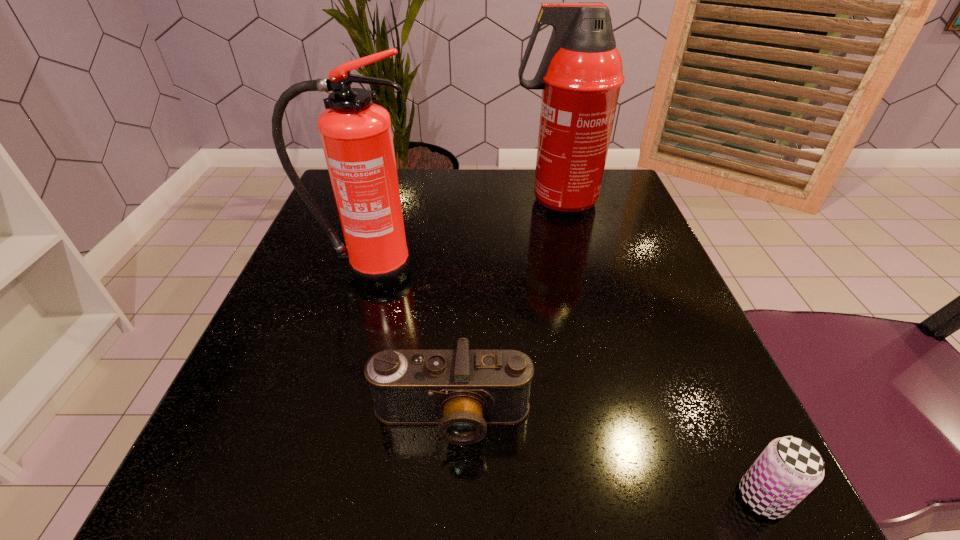
Where is `vacant point located between the beer can and the left fire extinguisher`? This screenshot has width=960, height=540. vacant point located between the beer can and the left fire extinguisher is located at coordinates pos(564,384).

Identify the location of empty space that is in between the farther fire extinguisher and the third nearest object. Image resolution: width=960 pixels, height=540 pixels. (462, 235).

Image resolution: width=960 pixels, height=540 pixels. Find the location of `vacant area that lies between the second farthest object and the nearest object`. vacant area that lies between the second farthest object and the nearest object is located at coordinates (564, 384).

Image resolution: width=960 pixels, height=540 pixels. What are the coordinates of `free area in between the second nearest object and the third nearest object` in the screenshot? It's located at (410, 344).

The height and width of the screenshot is (540, 960). What are the coordinates of `free point between the left fire extinguisher and the rightmost object` in the screenshot? It's located at (564, 384).

Where is `free spot between the farthest object and the rightmost object`? This screenshot has height=540, width=960. free spot between the farthest object and the rightmost object is located at coordinates (659, 349).

At what (x,y) coordinates should I click in order to perform the action: click on vacant area that lies between the camera and the nearer fire extinguisher. Please return your answer as a coordinate pair (x, y). The image size is (960, 540). Looking at the image, I should click on (410, 344).

Identify which object is the nearest to the farther fire extinguisher. Please provide its 2D coordinates. Your answer should be formatted as a tuple, i.e. [(x, y)], where the tuple contains the x and y coordinates of a point satisfying the conditions above.

[(356, 135)]

You are a GUI agent. You are given a task and a screenshot of the screen. Output one action in this format:
    pyautogui.click(x=<x>, y=<y>)
    Task: Click on the object that is the closest to the farther fire extinguisher
    
    Given the screenshot: What is the action you would take?
    (x=356, y=135)

Image resolution: width=960 pixels, height=540 pixels. Find the location of `free space that satisfies the following two spatial constraints: 1. on the trigger side of the farthest object; 2. on the lens of the camera`. free space that satisfies the following two spatial constraints: 1. on the trigger side of the farthest object; 2. on the lens of the camera is located at coordinates [x=609, y=417].